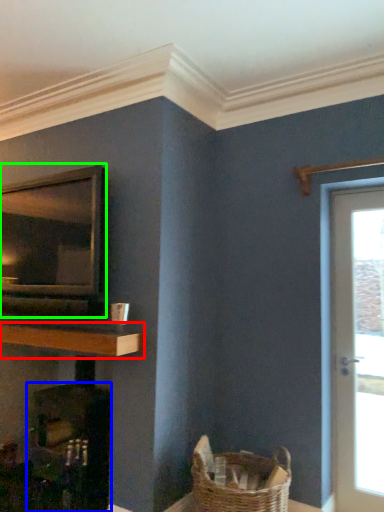
Question: Which object is positioned closest to shelf (highlighted by a red box)? Select from fireplace (highlighted by a blue box) and appliance (highlighted by a green box).

Choices:
 (A) fireplace
 (B) appliance

Answer: (B)